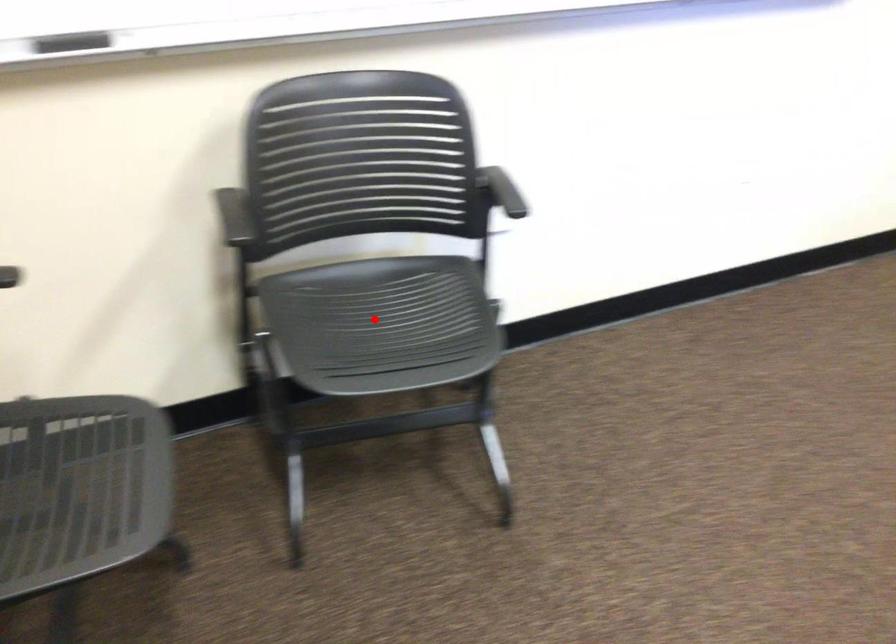
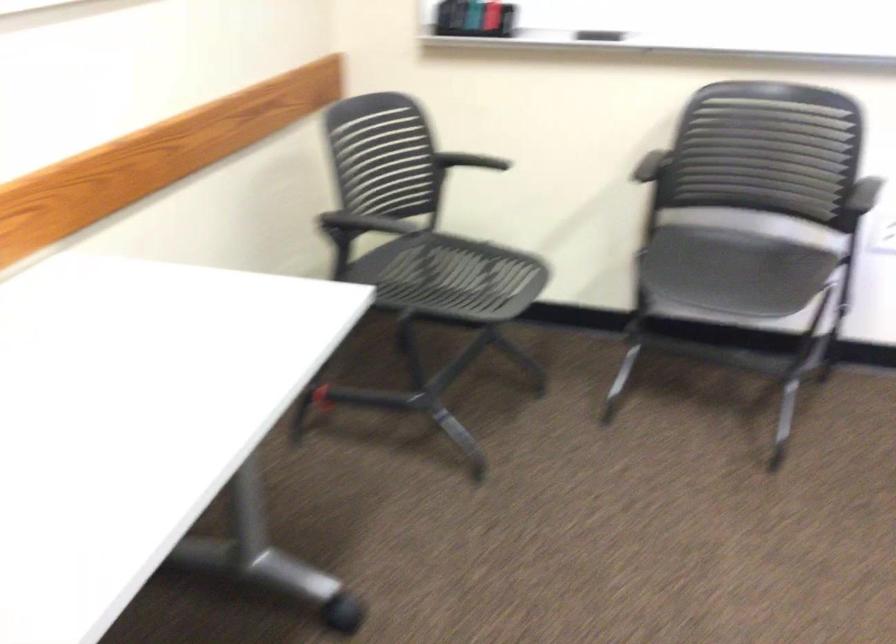
The point at the highlighted location is marked in the first image. Where is the corresponding point in the second image?

(731, 270)